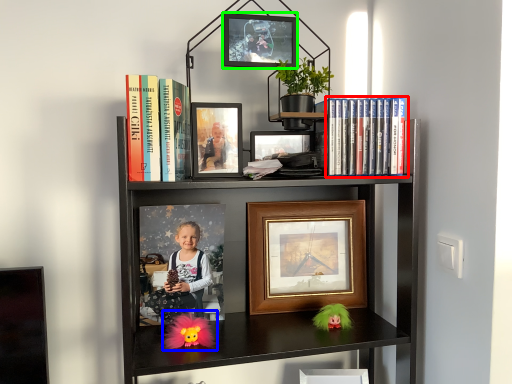
Question: Which is nearer to the book (highlighted by a red box)? doll (highlighted by a blue box) or picture frame (highlighted by a green box).

Choices:
 (A) doll
 (B) picture frame

Answer: (B)